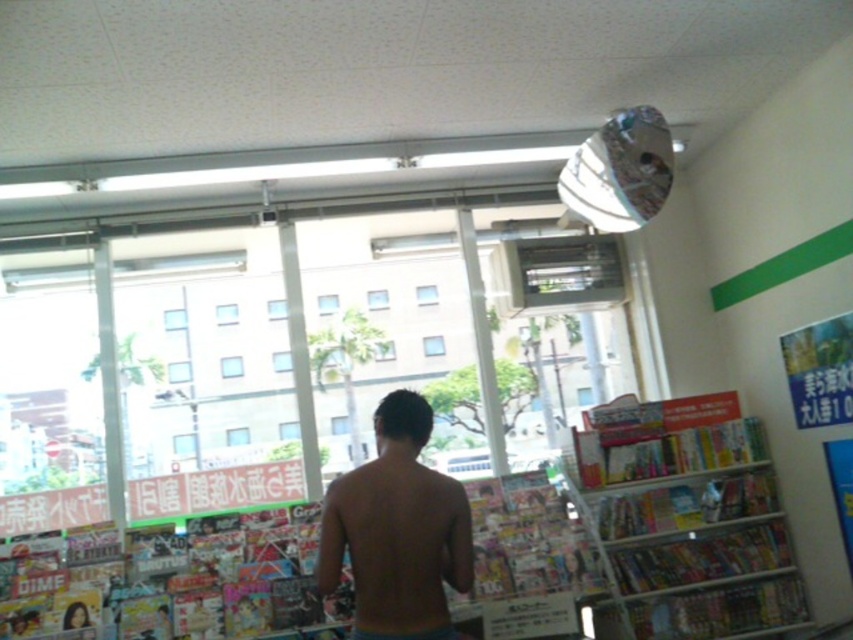
You are a customer in this store and want to reach the multicolored paperbacks at right. Since you are shorter than the nude skin at center, can you still reach them?

The multicolored paperbacks at right has a greater height compared to nude skin at center. Since the paperbacks are taller than the person, you might need a stool or ask for help to reach them.

You are standing at the entrance of the store and want to reach the multicolored paperbacks at right. Which direction should you move towards?

The multicolored paperbacks at right are located at point (685, 516), so you should move towards the right side of the store to reach them.